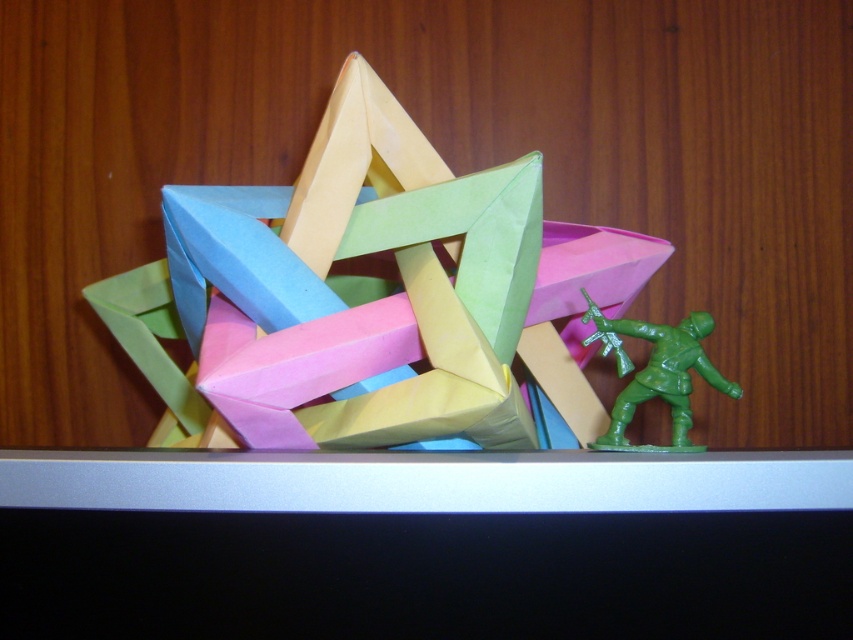
At what (x,y) coordinates should I click in order to perform the action: click on pastel paper star at center. Please return your answer as a coordinate pair (x, y). Looking at the image, I should click on (374, 294).

Does pastel paper star at center have a lesser width compared to green plastic toy soldier at lower right?

In fact, pastel paper star at center might be wider than green plastic toy soldier at lower right.

This screenshot has width=853, height=640. What do you see at coordinates (374, 294) in the screenshot?
I see `pastel paper star at center` at bounding box center [374, 294].

Where is `pastel paper star at center`? The image size is (853, 640). pastel paper star at center is located at coordinates (374, 294).